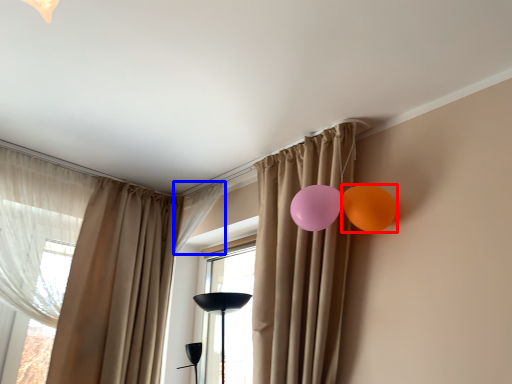
Question: Which of the following is the closest to the observer, balloon (highlighted by a red box) or curtain (highlighted by a blue box)?

Choices:
 (A) balloon
 (B) curtain

Answer: (A)